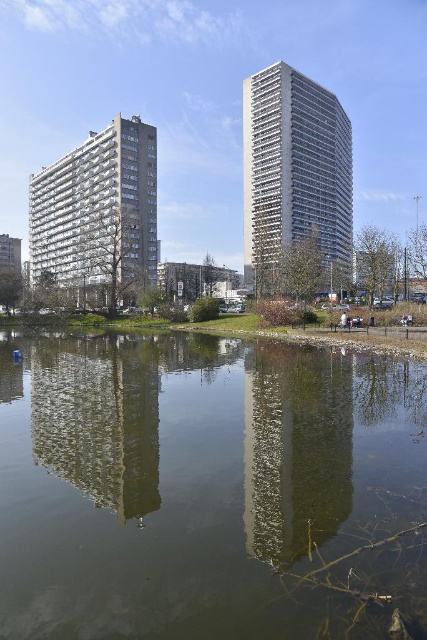
You are a drone operator trying to capture a photo of the two high rise buildings in the image. The camera is currently positioned above the green reflective water at center. To ensure the buildings are fully visible in the photo, should you adjust the camera position upwards or downwards relative to the current position?

Since the green reflective water at center is located at point (208, 490), adjusting the camera position upwards would bring the buildings into full view as they are positioned above the water surface.

You are a city planner reviewing architectural plans for two new buildings. The white textured building at center and the white textured building at left are part of the design. Based on the scene description, which building would require more construction materials in terms of volume?

The white textured building at center has a larger size compared to the white textured building at left, so it would require more construction materials in terms of volume.